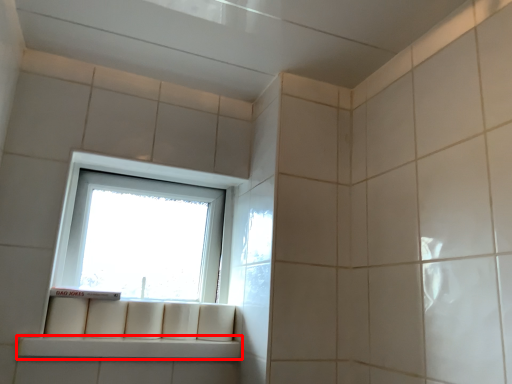
Question: From the image's perspective, where is window sill (annotated by the red box) located in relation to window in the image?

Choices:
 (A) below
 (B) above

Answer: (A)